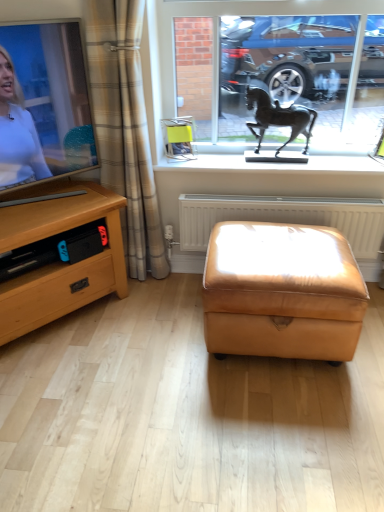
Find the location of `vacant area that is in front of beige plaid curtain at left`. vacant area that is in front of beige plaid curtain at left is located at coordinates (160, 300).